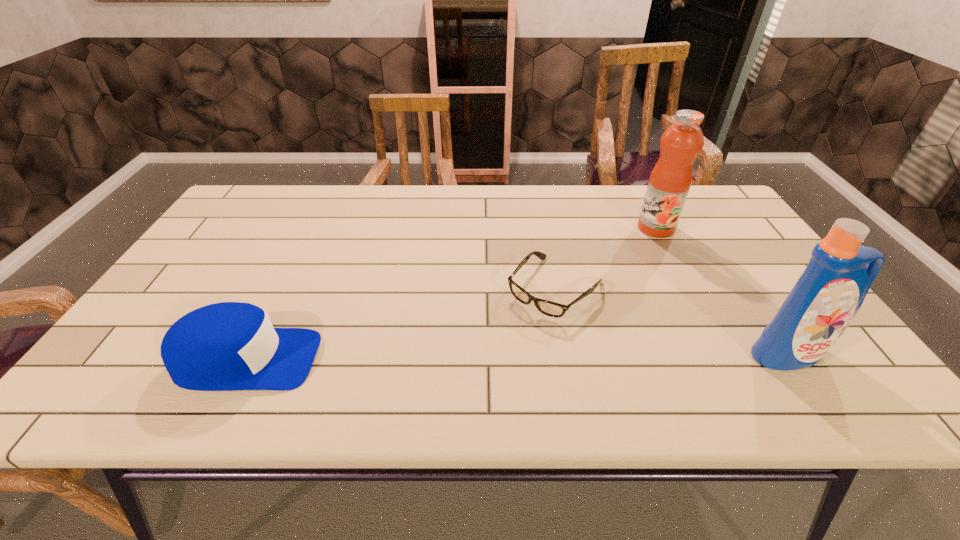
The height and width of the screenshot is (540, 960). I want to click on free space between the detergent and the farthest object, so click(x=723, y=291).

At what (x,y) coordinates should I click in order to perform the action: click on vacant space that is in between the baseball cap and the second farthest object. Please return your answer as a coordinate pair (x, y). Looking at the image, I should click on (400, 324).

Identify the location of free space between the third nearest object and the second object from right to left. (606, 258).

The height and width of the screenshot is (540, 960). I want to click on vacant area that lies between the detergent and the baseball cap, so click(x=517, y=356).

You are a GUI agent. You are given a task and a screenshot of the screen. Output one action in this format:
    pyautogui.click(x=<x>, y=<y>)
    Task: Click on the vacant area between the leftmost object and the rightmost object
    
    Given the screenshot: What is the action you would take?
    pyautogui.click(x=517, y=356)

I want to click on free space that is in between the third object from right to left and the rightmost object, so click(x=672, y=321).

Find the location of a particular element. object that ranks as the third closest to the detergent is located at coordinates (226, 346).

Locate which object ranks third in proximity to the second shortest object. Please provide its 2D coordinates. Your answer should be formatted as a tuple, i.e. [(x, y)], where the tuple contains the x and y coordinates of a point satisfying the conditions above.

[(827, 296)]